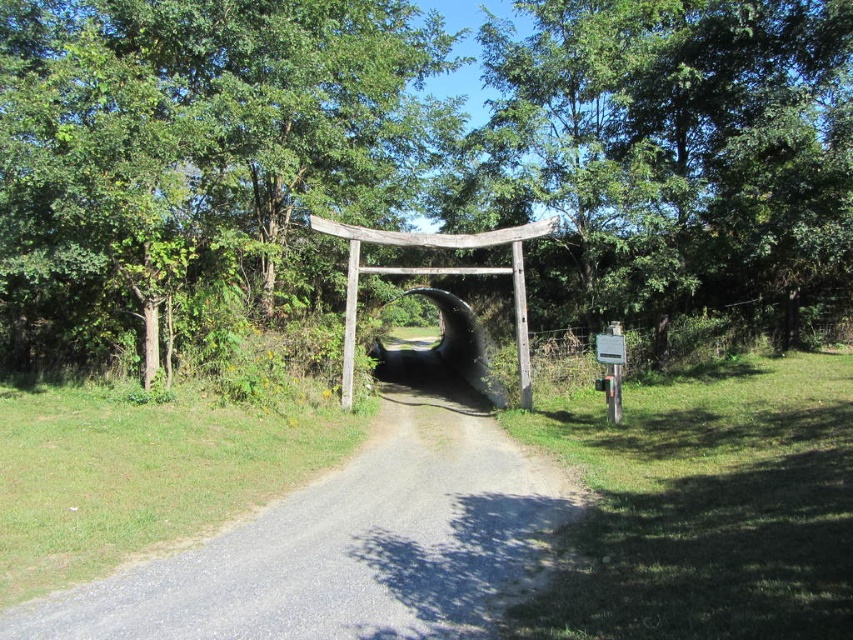
Question: Is green wood tree at center smaller than green leafy tree at center?

Choices:
 (A) no
 (B) yes

Answer: (A)

Question: Can you confirm if green wood tree at center is thinner than gray gravel path at center?

Choices:
 (A) yes
 (B) no

Answer: (B)

Question: Which object appears closest to the camera in this image?

Choices:
 (A) green wood tree at center
 (B) green leafy tree at center

Answer: (A)

Question: Does green leafy tree at center have a smaller size compared to gray gravel path at center?

Choices:
 (A) yes
 (B) no

Answer: (B)

Question: Which is nearer to the green leafy tree at center?

Choices:
 (A) gray gravel path at center
 (B) green wood tree at center

Answer: (B)

Question: Which of the following is the closest to the observer?

Choices:
 (A) (409, 67)
 (B) (479, 576)
 (C) (670, 60)

Answer: (B)